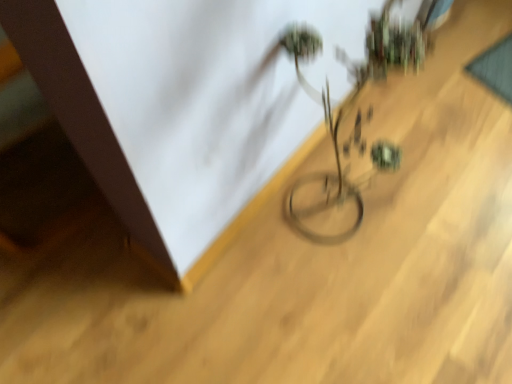
Where is `vacant space underneath green matte houseplant at center (from a real-world perspective)`? The height and width of the screenshot is (384, 512). vacant space underneath green matte houseplant at center (from a real-world perspective) is located at coordinates (319, 213).